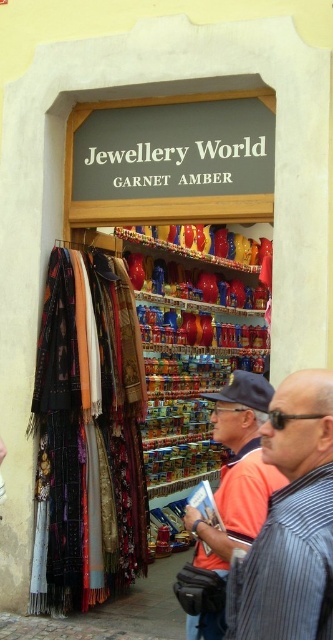
Consider the image. Between striped fabric shirt at center and orange shirt at center, which one is positioned higher?

striped fabric shirt at center is above.

Is striped fabric shirt at center bigger than orange shirt at center?

No, striped fabric shirt at center is not bigger than orange shirt at center.

At what (x,y) coordinates should I click in order to perform the action: click on striped fabric shirt at center. Please return your answer as a coordinate pair (x, y). Looking at the image, I should click on (291, 522).